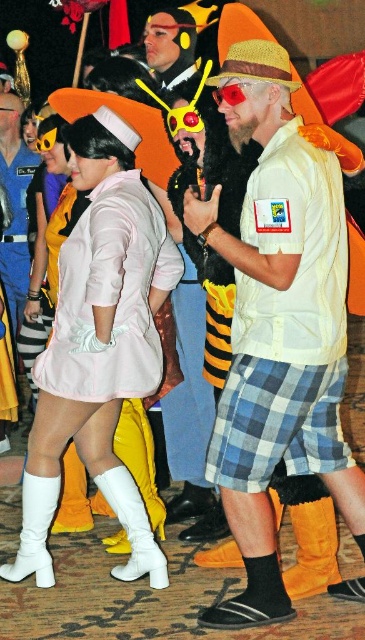
Does shiny plastic helmet at center have a greater width compared to orange suede boot at lower left?

Yes, shiny plastic helmet at center is wider than orange suede boot at lower left.

Between point (159, 83) and point (73, 470), which one is positioned in front?

Point (73, 470) is more forward.

Which is in front, point (175, 77) or point (67, 509)?

Point (67, 509) is in front.

What are the coordinates of `shiny plastic helmet at center` in the screenshot? It's located at 170,45.

Does white matte boots at lower left appear on the right side of shiny plastic helmet at center?

No, white matte boots at lower left is not to the right of shiny plastic helmet at center.

Does white matte boots at lower left come in front of shiny plastic helmet at center?

Yes, it is.

Who is more forward, (136, 392) or (174, 16)?

Positioned in front is point (136, 392).

Where is `white matte boots at lower left`? The width and height of the screenshot is (365, 640). white matte boots at lower left is located at coordinates (98, 348).

Is matte white shirt at center positioned before shiny plastic helmet at center?

That is True.

Who is more forward, (250, 552) or (190, 44)?

Point (250, 552) is in front.

Who is more distant from viewer, (297, 148) or (168, 35)?

Point (168, 35)

You are a GUI agent. You are given a task and a screenshot of the screen. Output one action in this format:
    pyautogui.click(x=<x>, y=<y>)
    Task: Click on the matte white shirt at center
    Image resolution: width=365 pixels, height=640 pixels.
    Given the screenshot: What is the action you would take?
    pyautogui.click(x=278, y=330)